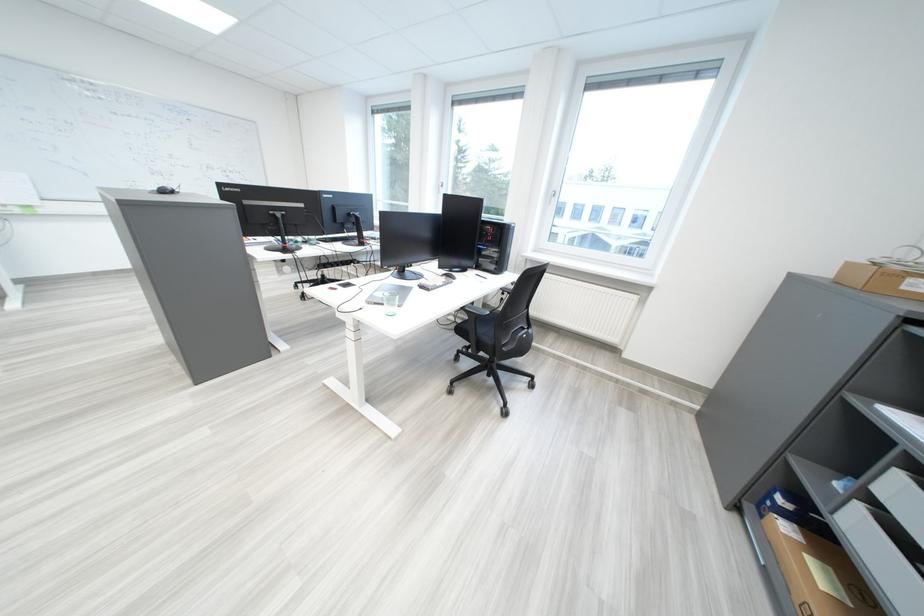
Where is `chair armrest`? Image resolution: width=924 pixels, height=616 pixels. chair armrest is located at coordinates (477, 312).